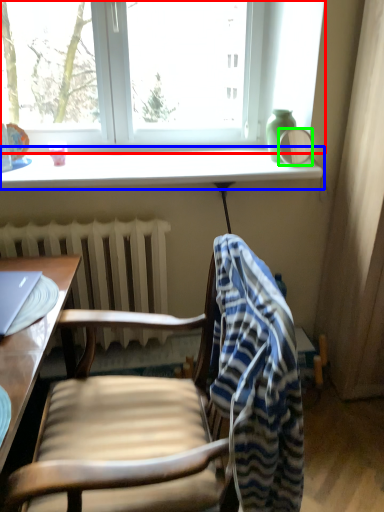
Question: Considering the real-world distances, which object is farthest from window (highlighted by a red box)? window sill (highlighted by a blue box) or mirror (highlighted by a green box)?

Choices:
 (A) window sill
 (B) mirror

Answer: (B)